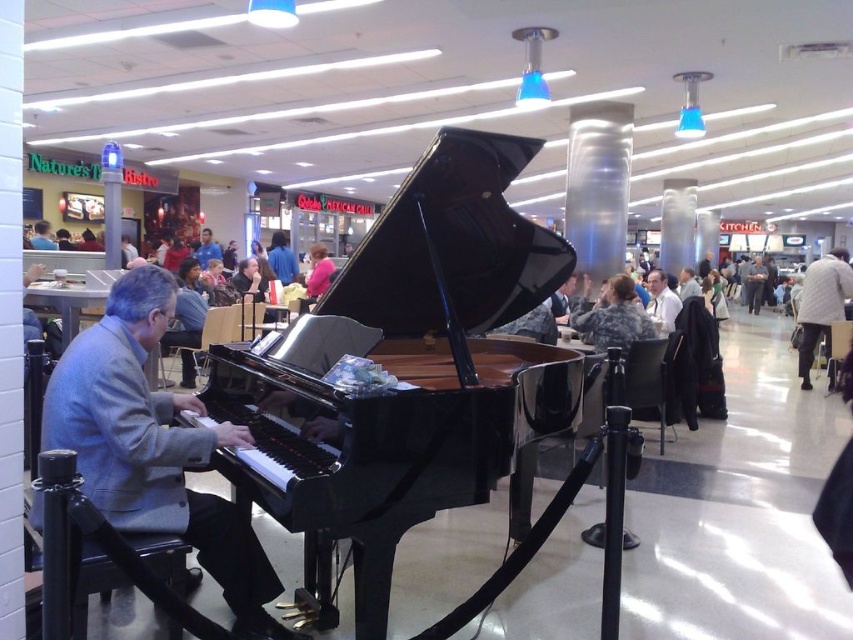
Is black polished piano at center shorter than gray woolen jacket at left?

In fact, black polished piano at center may be taller than gray woolen jacket at left.

Is the position of black polished piano at center more distant than that of gray woolen jacket at left?

No, it is not.

Which is behind, point (401, 472) or point (171, 296)?

Point (171, 296)

The height and width of the screenshot is (640, 853). What are the coordinates of `black polished piano at center` in the screenshot? It's located at (410, 371).

Is black polished piano at center smaller than pink fabric jacket at center?

Actually, black polished piano at center might be larger than pink fabric jacket at center.

Does black polished piano at center appear over pink fabric jacket at center?

Incorrect, black polished piano at center is not positioned above pink fabric jacket at center.

Between point (457, 472) and point (317, 259), which one is positioned in front?

Positioned in front is point (457, 472).

Locate an element on the screen. black polished piano at center is located at coordinates (410, 371).

Is gray woolen jacket at left taller than pink fabric jacket at center?

Indeed, gray woolen jacket at left has a greater height compared to pink fabric jacket at center.

The image size is (853, 640). Identify the location of gray woolen jacket at left. (154, 448).